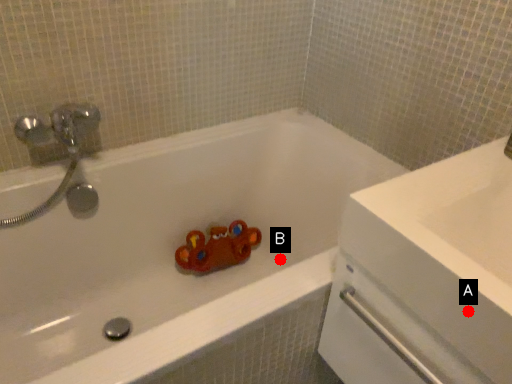
Question: Two points are circled on the image, labeled by A and B beside each circle. Which point appears closest to the camera in this image?

Choices:
 (A) A is closer
 (B) B is closer

Answer: (A)